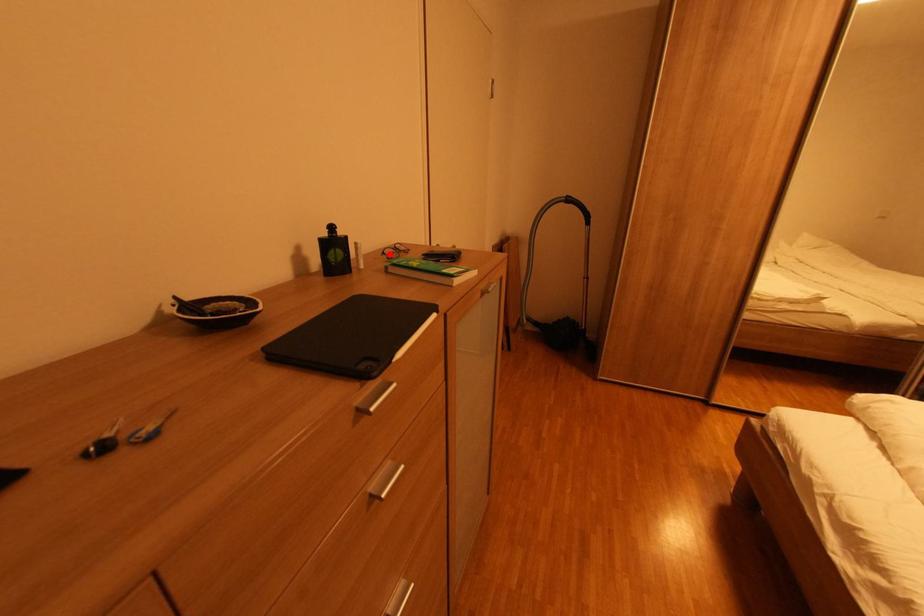
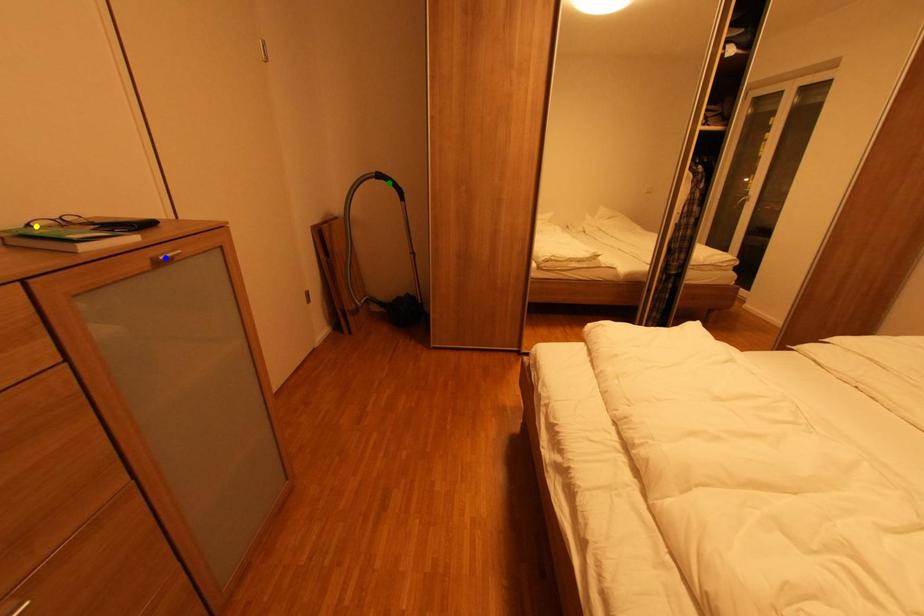
Question: I am providing you with two images of the same scene from different viewpoints. A red point is marked on the first image. You are given multiple points on the second image. Which point in image 2 is actually the same real-world point as the red point in image 1?

Choices:
 (A) yellow point
 (B) green point
 (C) blue point

Answer: (A)